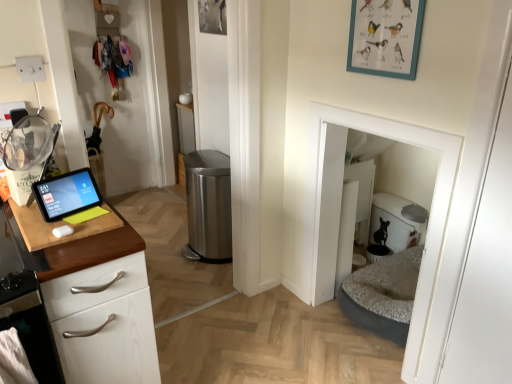
In order to click on vacant space situated above light wood/white cabinetry at left (from a real-world perspective) in this screenshot , I will do `click(78, 223)`.